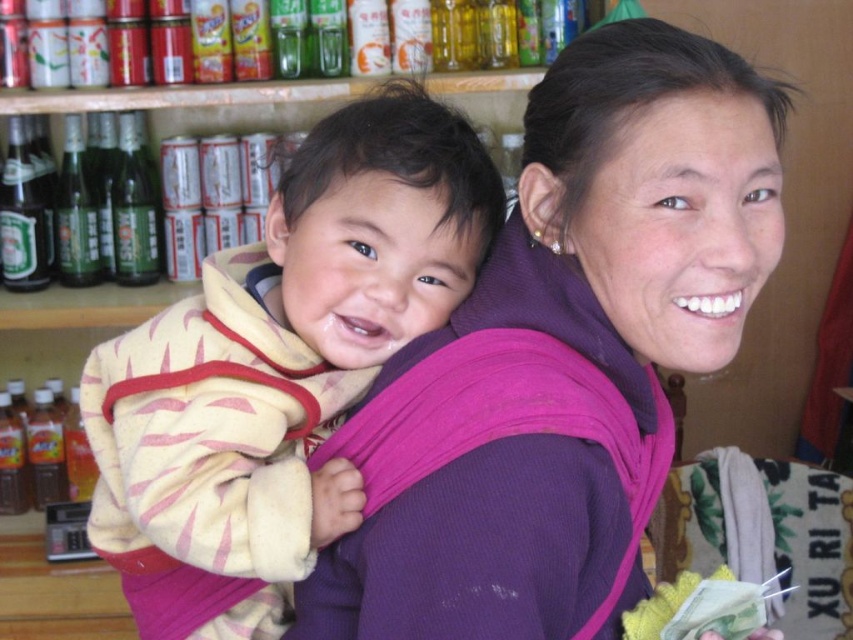
You are a photographer standing 30 inches away from the yellow fleece baby at center. Can you take a clear photo without moving closer?

The yellow fleece baby at center is 29.55 inches away from the viewer, so you are only 0.45 inches too far to take a clear photo without moving closer.